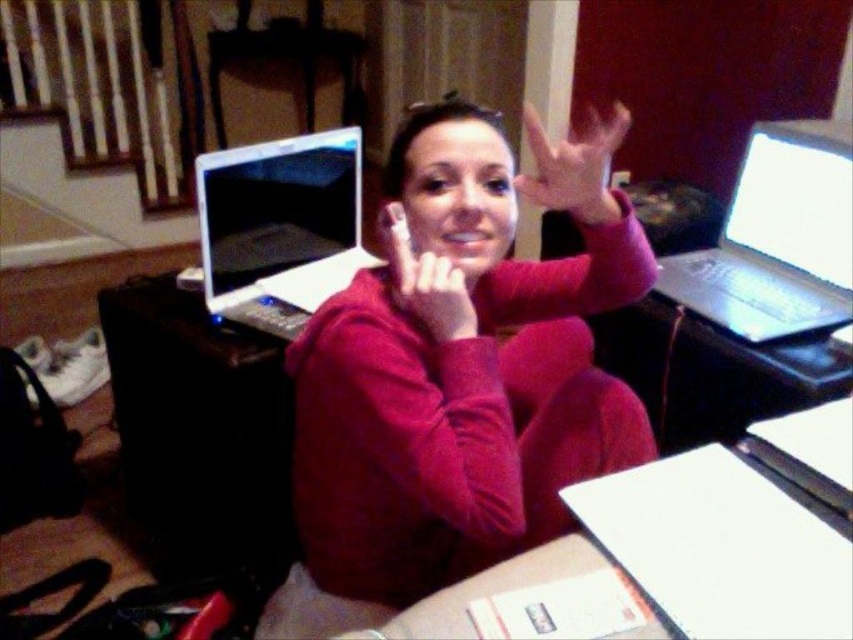
Question: Among these points, which one is farthest from the camera?

Choices:
 (A) (730, 522)
 (B) (283, 588)
 (C) (811, 147)
 (D) (434, 292)

Answer: (C)

Question: Can you confirm if white paper at center is positioned to the right of matte pink hand at center?

Choices:
 (A) no
 (B) yes

Answer: (B)

Question: In this image, where is matte pink hand at center located relative to matte pink fabric at lower center?

Choices:
 (A) below
 (B) above

Answer: (B)

Question: Which point is farther to the camera?

Choices:
 (A) (706, 630)
 (B) (325, 596)

Answer: (B)

Question: Can you confirm if white glossy laptop at upper right is bigger than matte pink hand at center?

Choices:
 (A) yes
 (B) no

Answer: (A)

Question: Among these points, which one is farthest from the camera?

Choices:
 (A) (299, 584)
 (B) (811, 204)
 (C) (621, 112)

Answer: (C)